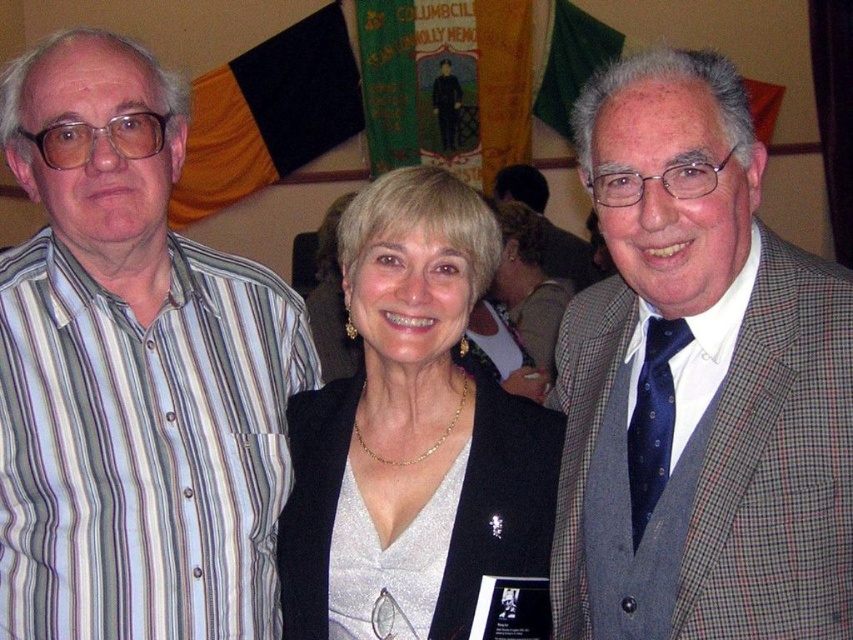
You are a photographer trying to adjust the lighting for a group photo. You notice two items at the center of the scene, the matte black jacket at center and the matte gray suit at center. Which of these two items is taller?

The matte black jacket at center is taller than the matte gray suit at center according to the description.

You are at the center of the room and want to move towards the silver metallic dress at center. Which direction should you move?

Since the silver metallic dress at center is located at point (416, 440), you should move towards the right and slightly forward to reach it.